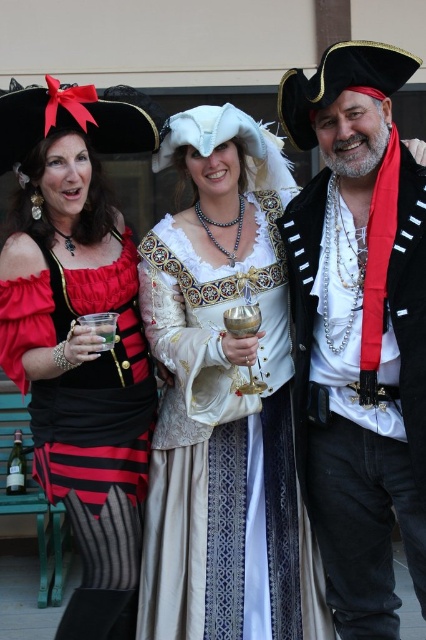
Describe the element at coordinates (359, 330) in the screenshot. I see `shiny black pirate hat at right` at that location.

Is shiny black pirate hat at right to the left of matte black pirate hat at upper left from the viewer's perspective?

No, shiny black pirate hat at right is not to the left of matte black pirate hat at upper left.

In order to click on shiny black pirate hat at right in this screenshot , I will do `click(359, 330)`.

Does white satin dress at center have a lesser height compared to matte black pirate hat at upper left?

Correct, white satin dress at center is not as tall as matte black pirate hat at upper left.

Between point (282, 356) and point (109, 563), which one is positioned in front?

Positioned in front is point (109, 563).

Consider the image. Who is more distant from viewer, (236,492) or (123,612)?

Positioned behind is point (236,492).

Identify the location of white satin dress at center. The height and width of the screenshot is (640, 426). (224, 401).

Between white satin dress at center and shiny black pirate hat at right, which one appears on the right side from the viewer's perspective?

Positioned to the right is shiny black pirate hat at right.

This screenshot has width=426, height=640. What do you see at coordinates (224, 401) in the screenshot? I see `white satin dress at center` at bounding box center [224, 401].

Find the location of a particular element. Image resolution: width=426 pixels, height=640 pixels. white satin dress at center is located at coordinates (224, 401).